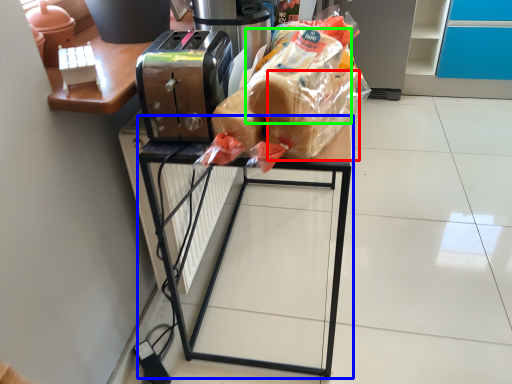
Question: Estimate the real-world distances between objects in this image. Which object is closer to bread (highlighted by a red box), furniture (highlighted by a blue box) or bread (highlighted by a green box)?

Choices:
 (A) furniture
 (B) bread

Answer: (B)